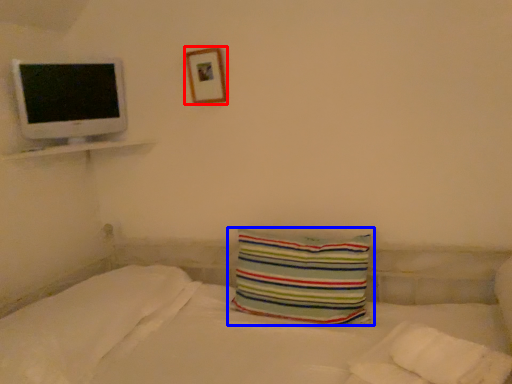
Question: Which point is further to the camera, picture frame (highlighted by a red box) or pillow (highlighted by a blue box)?

Choices:
 (A) picture frame
 (B) pillow

Answer: (A)